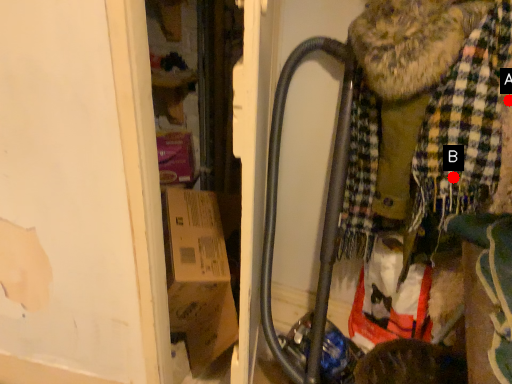
Question: Two points are circled on the image, labeled by A and B beside each circle. Which point appears farthest from the camera in this image?

Choices:
 (A) A is further
 (B) B is further

Answer: (B)